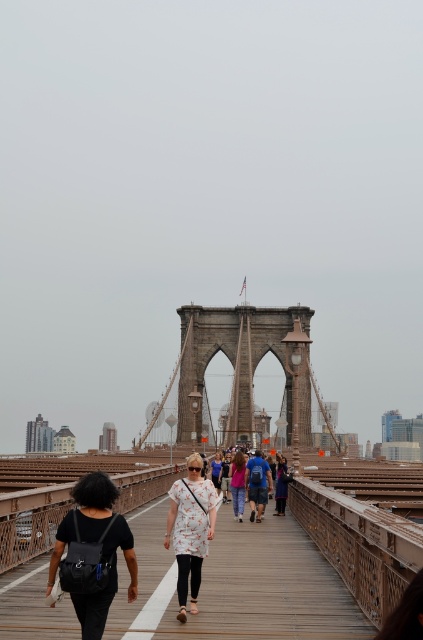
Question: Among these points, which one is nearest to the camera?

Choices:
 (A) (285, 472)
 (B) (104, 529)

Answer: (B)

Question: Is wooden bridge at center positioned behind black matte backpack at center?

Choices:
 (A) yes
 (B) no

Answer: (A)

Question: Which point is closer to the camera?

Choices:
 (A) (264, 326)
 (B) (255, 547)

Answer: (B)

Question: Considering the relative positions of stone bridge at center and pink fabric at center in the image provided, where is stone bridge at center located with respect to pink fabric at center?

Choices:
 (A) left
 (B) right

Answer: (B)

Question: Which object is positioned farthest from the pink fabric at center?

Choices:
 (A) wooden bridge at center
 (B) denim jacket at center

Answer: (A)

Question: Considering the relative positions of black matte backpack at center and pink fabric at center in the image provided, where is black matte backpack at center located with respect to pink fabric at center?

Choices:
 (A) left
 (B) right

Answer: (A)